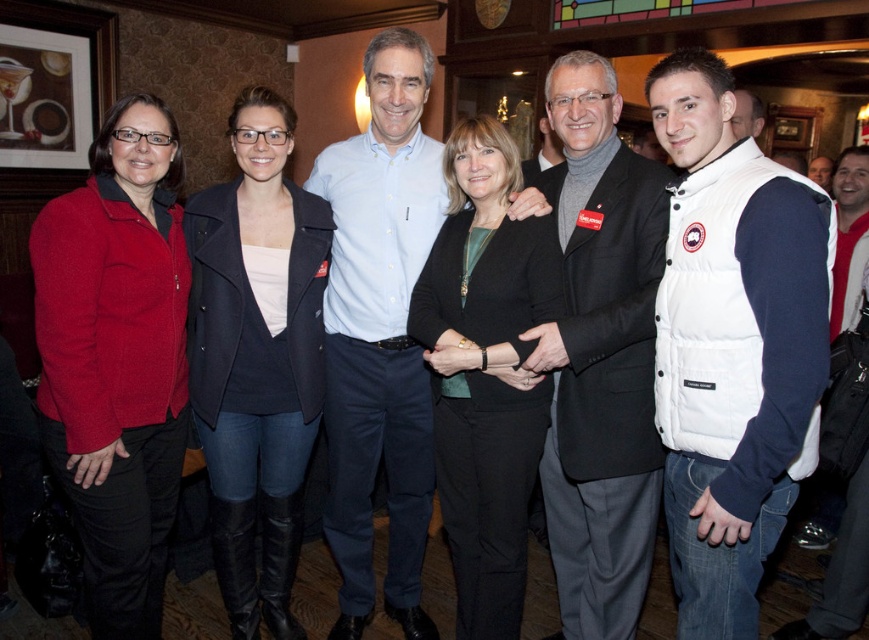
Describe the element at coordinates (380, 333) in the screenshot. The height and width of the screenshot is (640, 869). I see `light blue button-down shirt at center` at that location.

Who is higher up, light blue button-down shirt at center or black matte blazer at center?

Result: Positioned higher is light blue button-down shirt at center.

In order to click on light blue button-down shirt at center in this screenshot , I will do `click(380, 333)`.

Consider the image. Can you confirm if white down vest at center is bigger than matte red jacket at left?

Actually, white down vest at center might be smaller than matte red jacket at left.

Image resolution: width=869 pixels, height=640 pixels. I want to click on white down vest at center, so [732, 346].

Is matte black jacket at center taller than black matte blazer at center?

Correct, matte black jacket at center is much taller as black matte blazer at center.

What do you see at coordinates (256, 358) in the screenshot?
I see `matte black jacket at center` at bounding box center [256, 358].

In order to click on matte black jacket at center in this screenshot , I will do `click(256, 358)`.